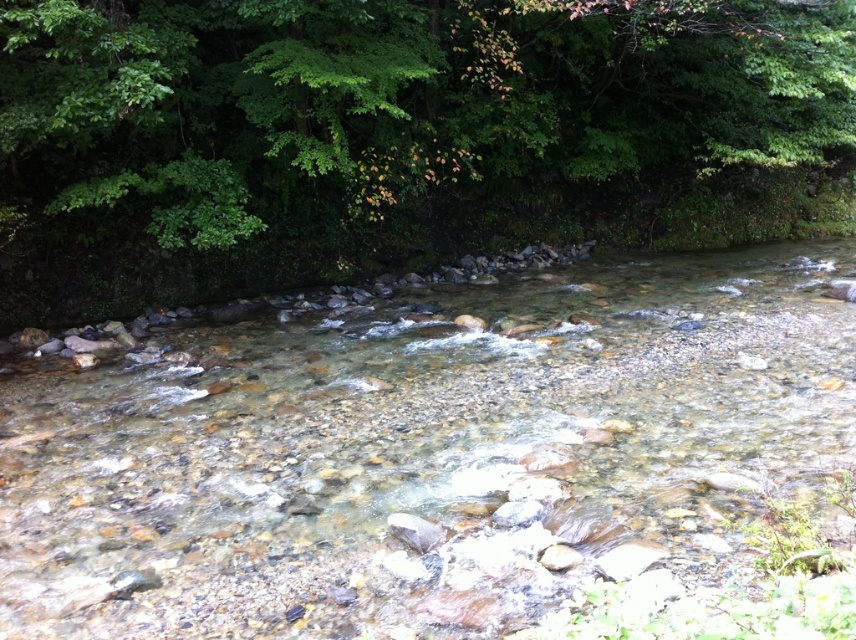
Which is behind, point (230, 506) or point (217, 93)?

The point (217, 93) is behind.

Does translucent rocky stream at center appear over green leafy tree at upper center?

No, translucent rocky stream at center is not above green leafy tree at upper center.

You are a GUI agent. You are given a task and a screenshot of the screen. Output one action in this format:
    pyautogui.click(x=<x>, y=<y>)
    Task: Click on the translucent rocky stream at center
    Image resolution: width=856 pixels, height=640 pixels.
    Given the screenshot: What is the action you would take?
    pyautogui.click(x=415, y=449)